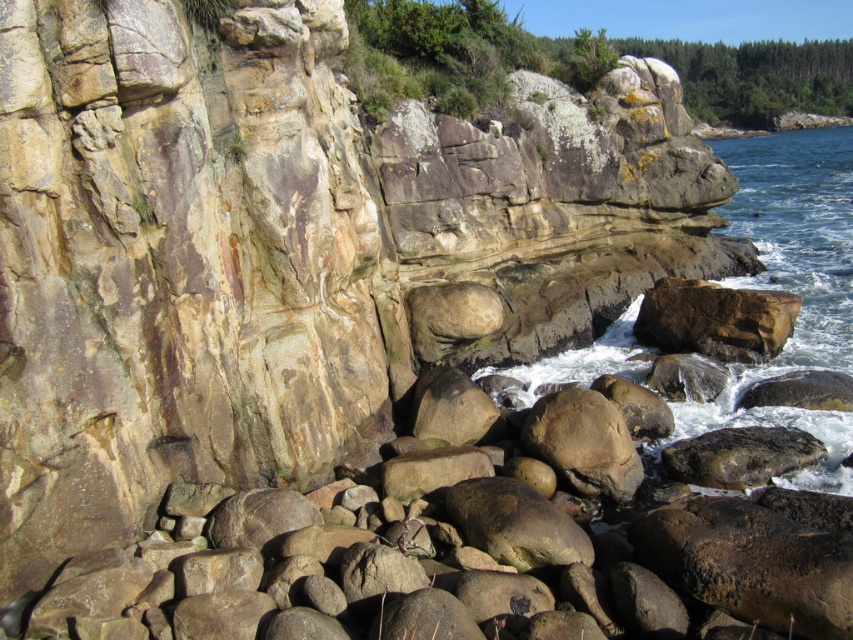
Question: Among these objects, which one is farthest from the camera?

Choices:
 (A) brown rough rock at center
 (B) clear blue water at right

Answer: (B)

Question: Does clear blue water at right appear under brown rough rock at center?

Choices:
 (A) no
 (B) yes

Answer: (A)

Question: Which object is farther from the camera taking this photo?

Choices:
 (A) clear blue water at right
 (B) brown rough rock at center

Answer: (A)

Question: Can you confirm if clear blue water at right is positioned above brown rough rock at center?

Choices:
 (A) no
 (B) yes

Answer: (B)

Question: Does clear blue water at right have a greater width compared to brown rough rock at center?

Choices:
 (A) yes
 (B) no

Answer: (A)